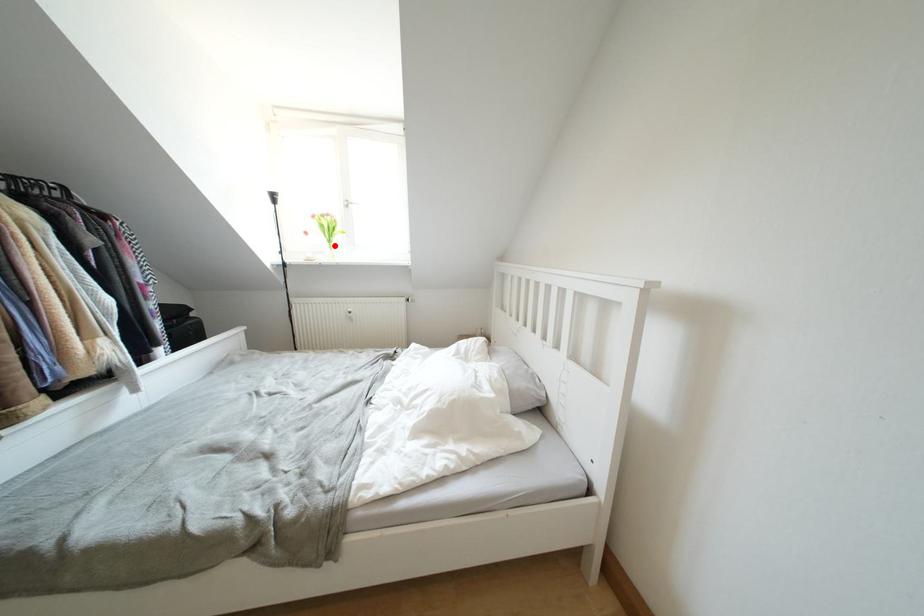
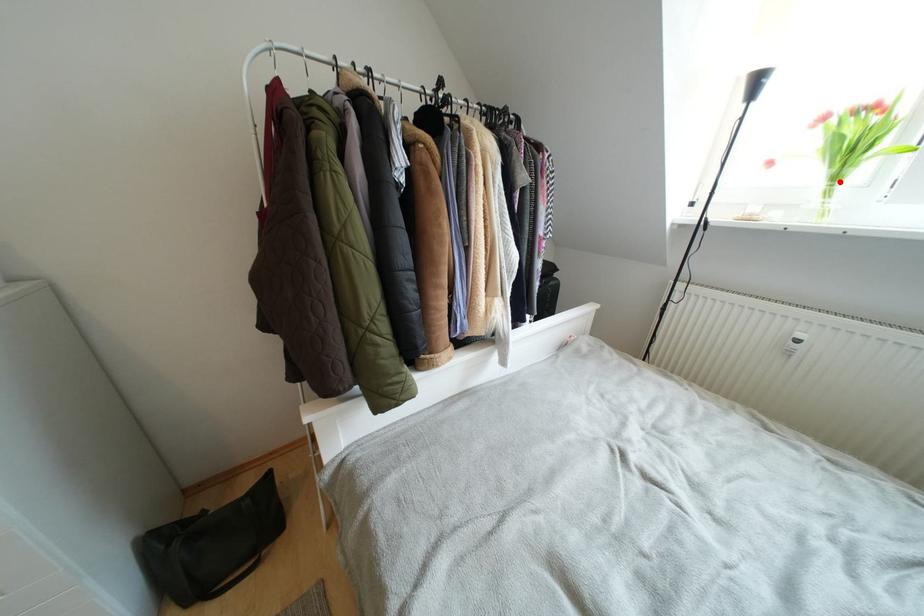
I am providing you with two images of the same scene from different viewpoints. A red point is marked on the first image and another point is marked on the second image. Is the marked point in image1 the same physical position as the marked point in image2?

Yes